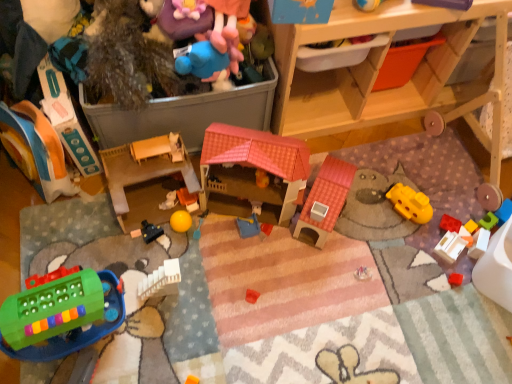
The width and height of the screenshot is (512, 384). In order to click on vacant space that is in between white matte block at lower right, positioned as the second toy in right-to-left order, and green plastic building block at lower left, which is the 3th toy in left-to-right order in this screenshot , I will do `click(280, 288)`.